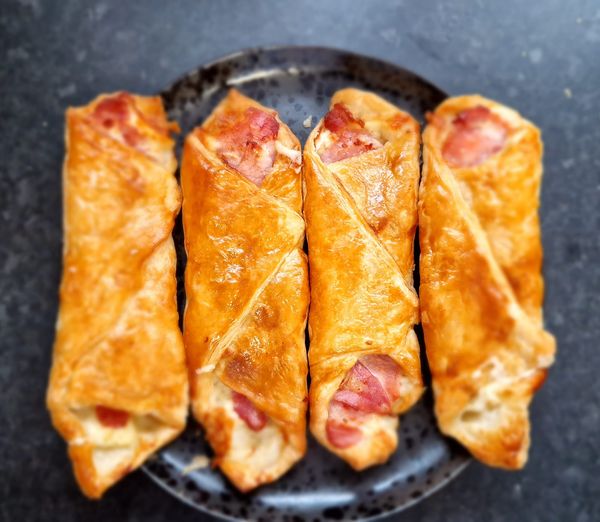
Locate an element on the screen. This screenshot has height=522, width=600. black speckled countertop is located at coordinates (45, 66), (590, 422).